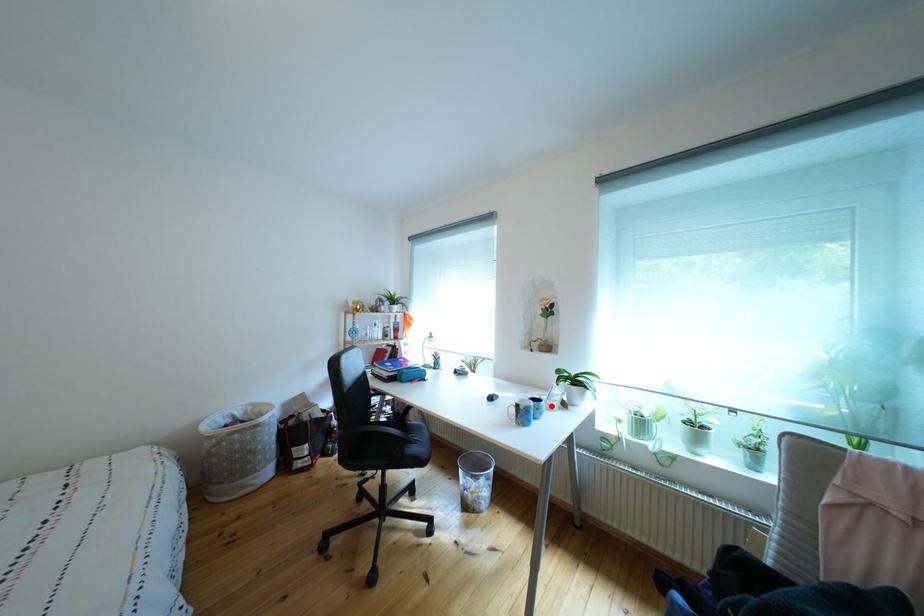
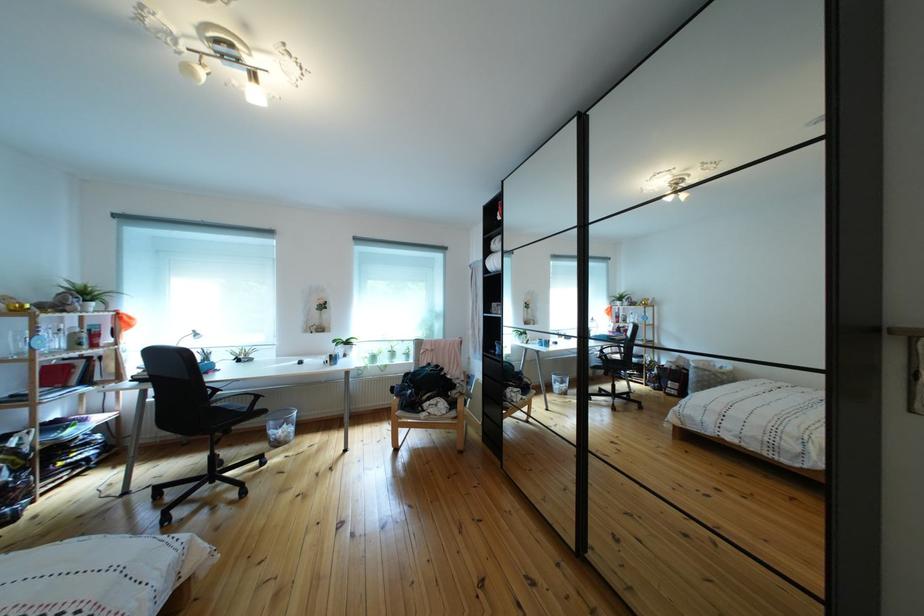
Question: I am providing you with two images of the same scene from different viewpoints. A red point is marked on the first image. Can you still see the location of the red point in image 2?

Choices:
 (A) Yes
 (B) No

Answer: (B)